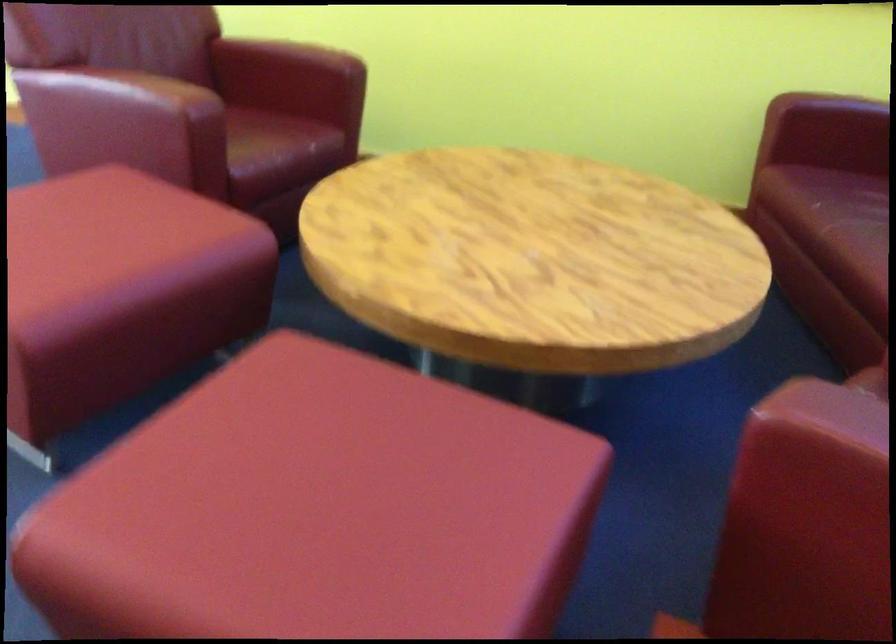
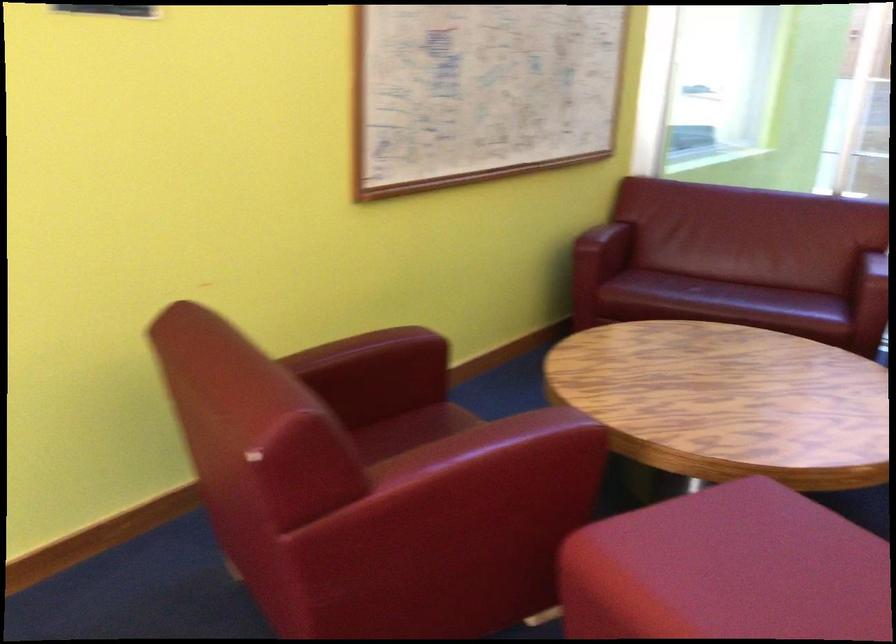
Locate, in the second image, the point that corresponds to [825,223] in the first image.

(719, 297)